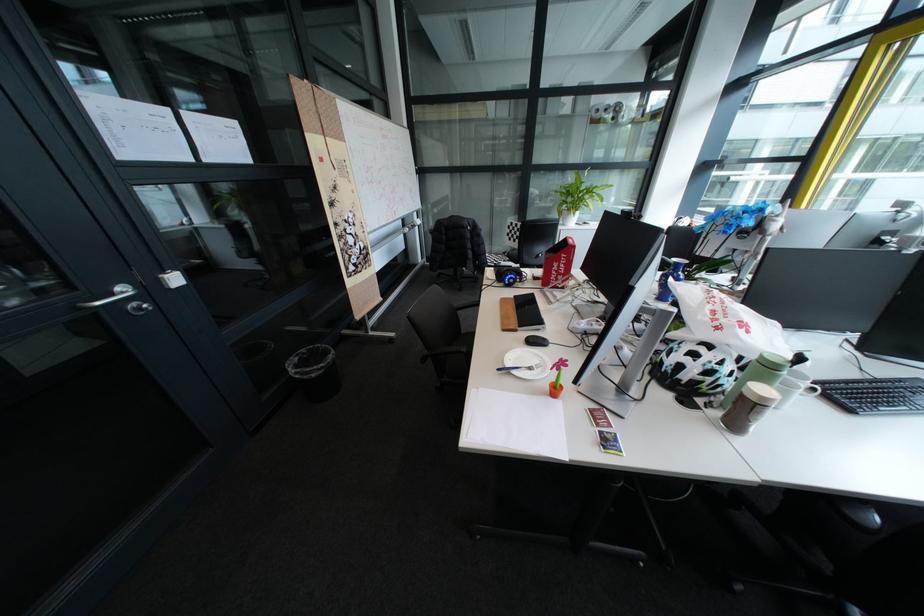
The width and height of the screenshot is (924, 616). What do you see at coordinates (458, 363) in the screenshot?
I see `a chair sitting surface` at bounding box center [458, 363].